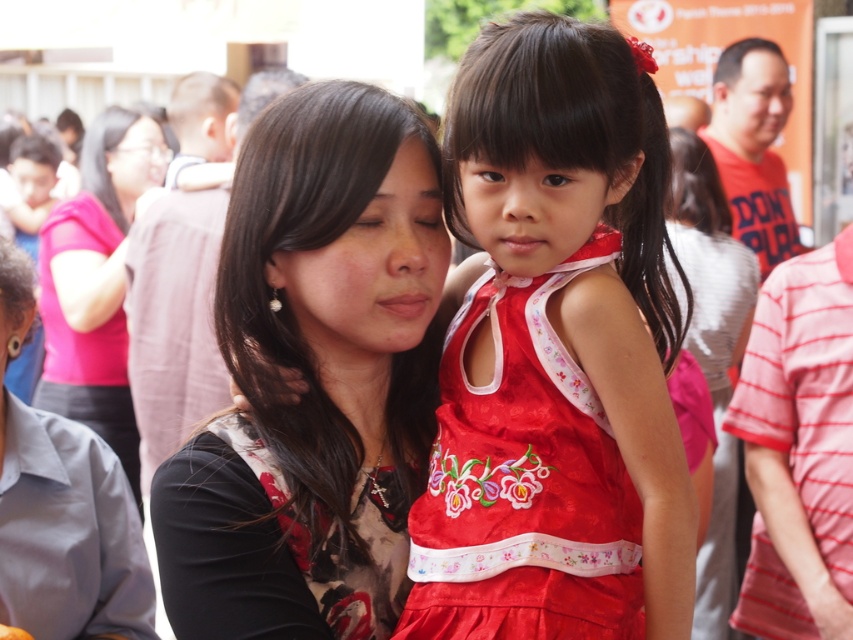
Between silky red dress at center and matte black shirt at center, which one is positioned higher?

matte black shirt at center

Describe the element at coordinates (556, 355) in the screenshot. I see `silky red dress at center` at that location.

Who is more distant from viewer, [577,20] or [165,168]?

The point [165,168] is behind.

Where is `silky red dress at center`? silky red dress at center is located at coordinates (556, 355).

Based on the photo, can you confirm if silky red dress at center is wider than black floral dress at center?

Correct, the width of silky red dress at center exceeds that of black floral dress at center.

Does silky red dress at center have a smaller size compared to black floral dress at center?

No, silky red dress at center is not smaller than black floral dress at center.

Which is in front, point (515, 422) or point (396, 614)?

Point (515, 422) is more forward.

The image size is (853, 640). I want to click on silky red dress at center, so click(556, 355).

The height and width of the screenshot is (640, 853). Describe the element at coordinates (312, 378) in the screenshot. I see `black floral dress at center` at that location.

Image resolution: width=853 pixels, height=640 pixels. Identify the location of black floral dress at center. (312, 378).

At what (x,y) coordinates should I click in order to perform the action: click on black floral dress at center. Please return your answer as a coordinate pair (x, y). The width and height of the screenshot is (853, 640). Looking at the image, I should click on (312, 378).

You are a GUI agent. You are given a task and a screenshot of the screen. Output one action in this format:
    pyautogui.click(x=<x>, y=<y>)
    Task: Click on the black floral dress at center
    The height and width of the screenshot is (640, 853).
    Given the screenshot: What is the action you would take?
    pyautogui.click(x=312, y=378)